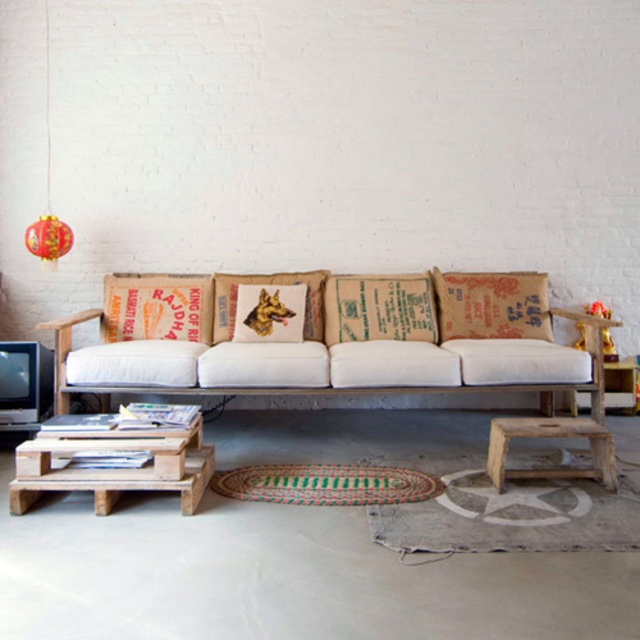
Question: Which of the following is the closest to the observer?

Choices:
 (A) white fabric couch at center
 (B) wooden stool at lower right

Answer: (B)

Question: Based on their relative distances, which object is farther from the brown burlap pillow at center?

Choices:
 (A) white fabric couch at center
 (B) wooden stool at lower right

Answer: (B)

Question: Does brown burlap pillow at right appear on the right side of red paper lantern at upper left?

Choices:
 (A) yes
 (B) no

Answer: (A)

Question: Among these points, which one is farthest from the camera?

Choices:
 (A) (244, 316)
 (B) (509, 308)
 (C) (35, 476)

Answer: (B)

Question: Is white fabric couch at center above red paper lantern at upper left?

Choices:
 (A) yes
 (B) no

Answer: (B)

Question: Does white fabric couch at center appear on the left side of wooden pallets at lower left?

Choices:
 (A) yes
 (B) no

Answer: (B)